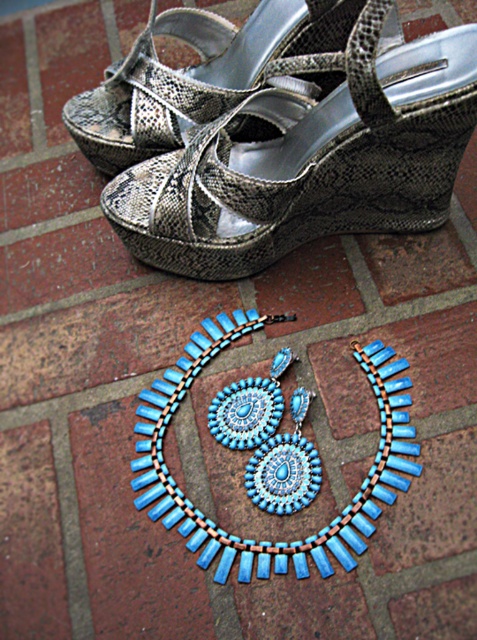
Question: Is snake skin silver sandal at upper center to the left of shiny metallic sandal at upper center from the viewer's perspective?

Choices:
 (A) yes
 (B) no

Answer: (B)

Question: Is snake skin silver sandal at upper center above turquoise beaded necklace at center?

Choices:
 (A) yes
 (B) no

Answer: (A)

Question: Which of the following is the closest to the observer?

Choices:
 (A) (216, 554)
 (B) (127, 65)

Answer: (A)

Question: Which point is closer to the camera taking this photo?

Choices:
 (A) (420, 221)
 (B) (182, 532)
 (C) (169, 100)

Answer: (B)

Question: Can you confirm if turquoise beaded necklace at center is smaller than shiny metallic sandal at upper center?

Choices:
 (A) no
 (B) yes

Answer: (B)

Question: Which is farther from the shiny metallic sandal at upper center?

Choices:
 (A) turquoise beaded necklace at center
 (B) snake skin silver sandal at upper center

Answer: (A)